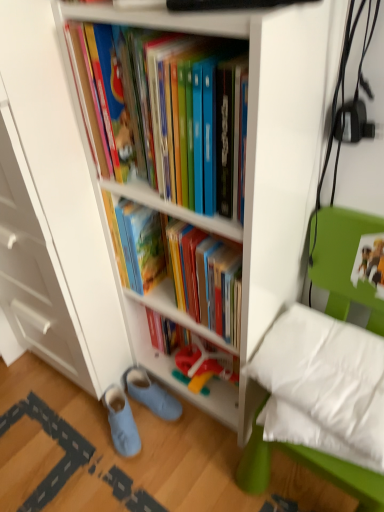
Identify the location of free area in between blue suede slippers at lower left, arranged as the second footwear when viewed from the left, and light blue fabric slippers at lower left, the 2th footwear when ordered from right to left. (150, 431).